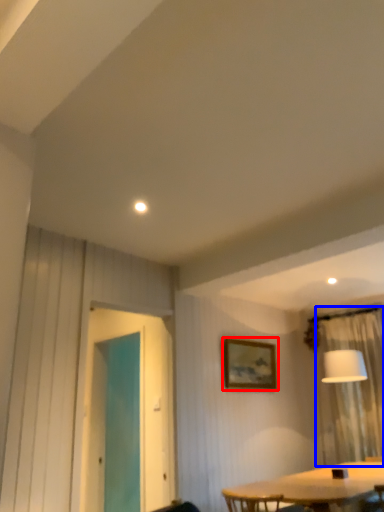
Question: Among these objects, which one is nearest to the camera, picture frame (highlighted by a red box) or curtain (highlighted by a blue box)?

Choices:
 (A) picture frame
 (B) curtain

Answer: (B)